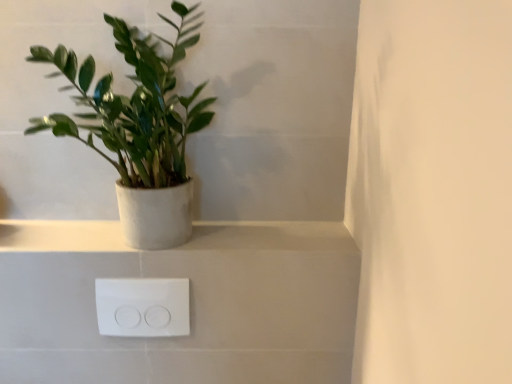
Where is `empty space that is ontop of white matte/porcelain shelf at upper center (from a real-world perspective)`? The width and height of the screenshot is (512, 384). empty space that is ontop of white matte/porcelain shelf at upper center (from a real-world perspective) is located at coordinates (189, 232).